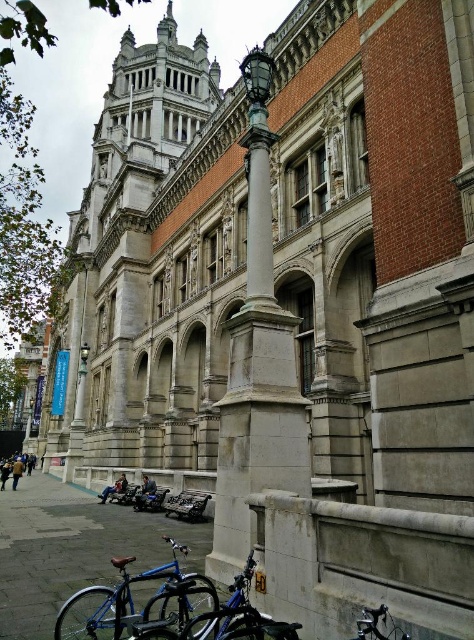
Question: Which of the following is the closest to the observer?

Choices:
 (A) slate gray stone column at center
 (B) smooth concrete pavement at lower left
 (C) shiny blue bicycle at lower center

Answer: (C)

Question: Considering the real-world distances, which object is closest to the slate gray stone column at center?

Choices:
 (A) blue matte bicycle at lower left
 (B) blue metallic bicycle at lower left
 (C) smooth concrete pavement at lower left
 (D) shiny blue bicycle at lower center

Answer: (B)

Question: Is smooth concrete pavement at lower left to the left of blue metallic bicycle at lower left from the viewer's perspective?

Choices:
 (A) no
 (B) yes

Answer: (B)

Question: Does blue matte bicycle at lower left have a lesser width compared to blue metallic bicycle at lower left?

Choices:
 (A) no
 (B) yes

Answer: (A)

Question: Can you confirm if slate gray stone column at center is positioned above shiny blue bicycle at lower center?

Choices:
 (A) yes
 (B) no

Answer: (A)

Question: Which point is closer to the camera?

Choices:
 (A) (255, 467)
 (B) (386, 618)
 (C) (36, 528)
 (D) (106, 593)

Answer: (B)